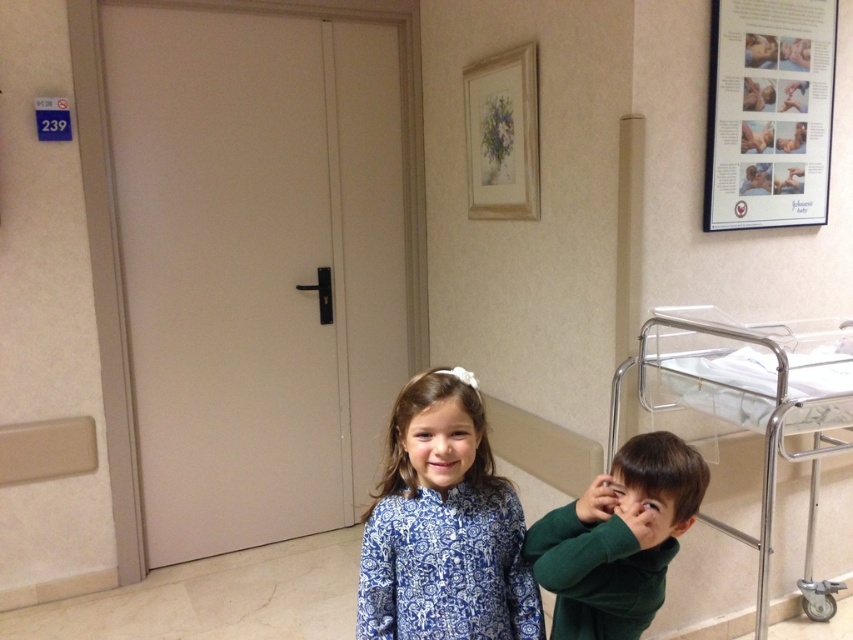
You are a nurse in a hospital. You see a patient wearing a blue printed dress at center and a metallic hospital bed at right. Which object is closer to you?

The blue printed dress at center is closer to you because it is in front of the metallic hospital bed at right.